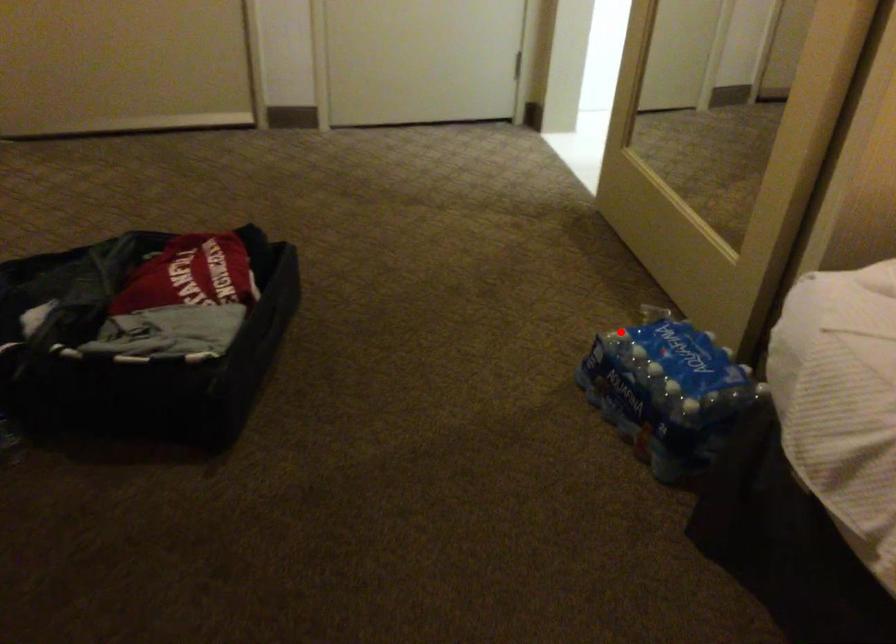
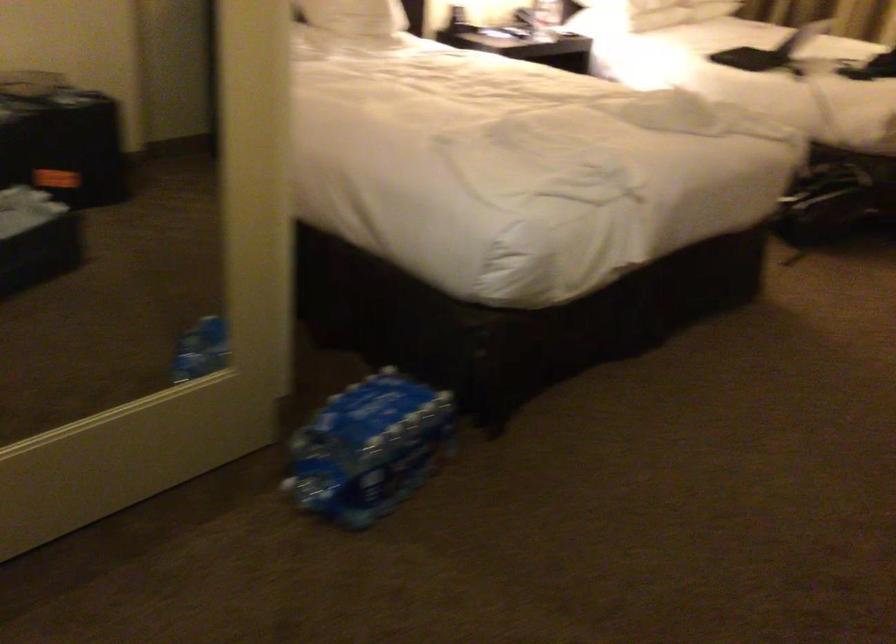
Find the pixel in the second image that matches the highlighted location in the first image.

(367, 448)